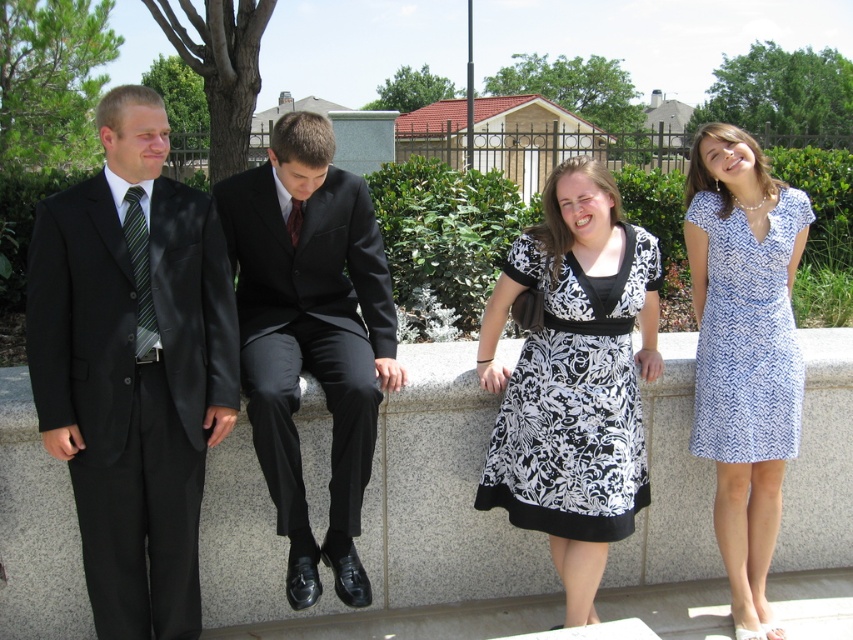
You are a photographer adjusting the camera settings to ensure all subjects are in focus. Given that the black satin suit at center and the black silk tie at center are both in your frame, which one requires more careful adjustment to maintain clarity due to its size?

The black satin suit at center requires more careful adjustment because it is larger in size than the black silk tie at center, making it more prominent in the frame and potentially needing sharper focus.